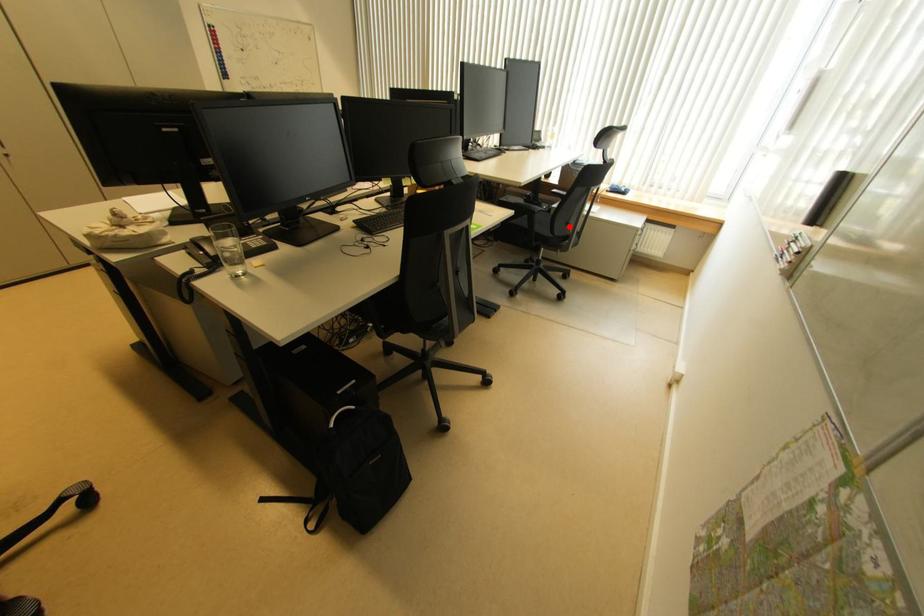
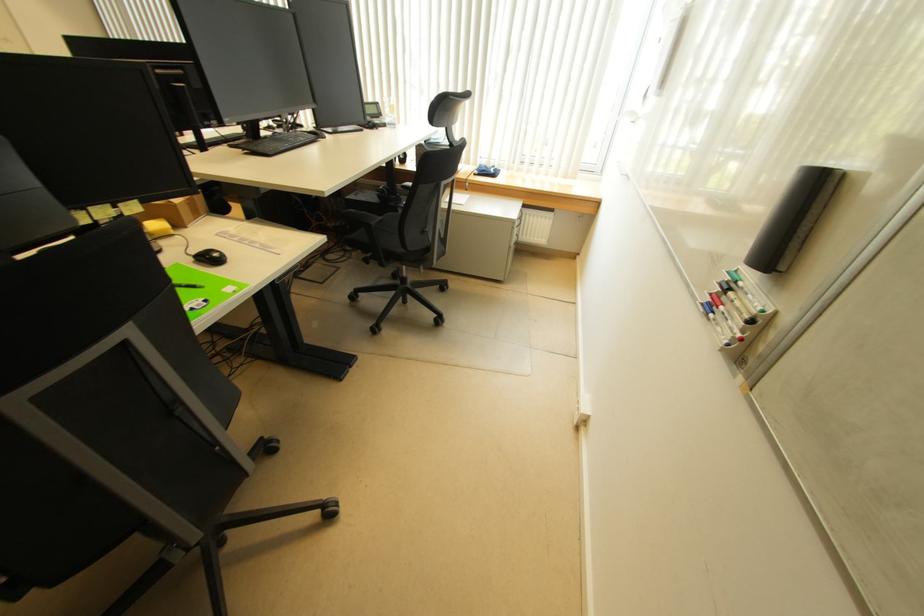
In the second image, find the point that corresponds to the highlighted location in the first image.

(426, 235)